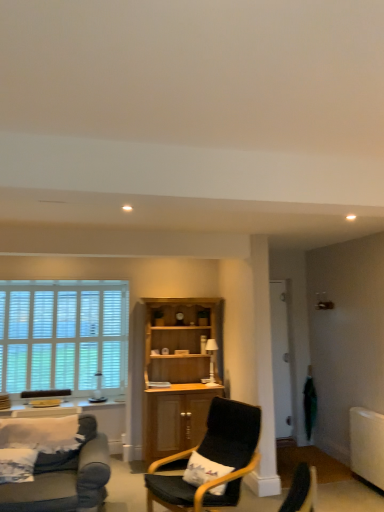
I want to click on vacant area on top of matte black armchair at lower left (from a real-world perspective), so click(x=51, y=390).